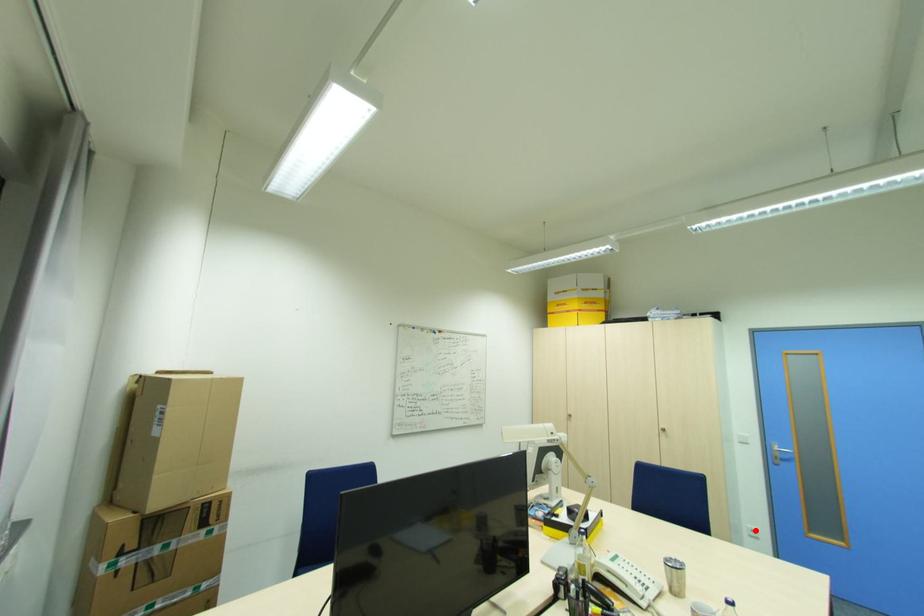
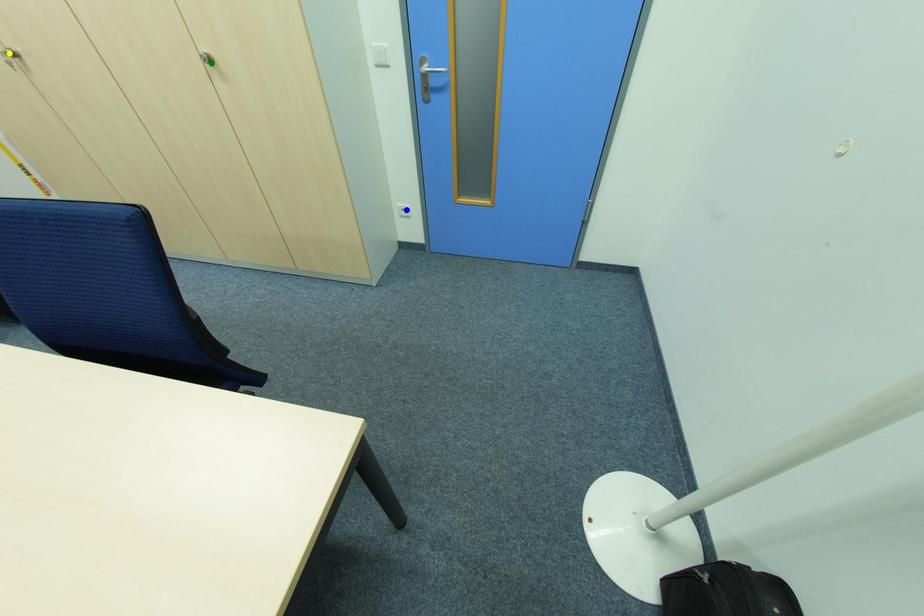
Question: I am providing you with two images of the same scene from different viewpoints. A red point is marked on the first image. You are given multiple points on the second image. Which mark in image 2 goes with the point in image 1?

Choices:
 (A) green point
 (B) yellow point
 (C) blue point

Answer: (C)